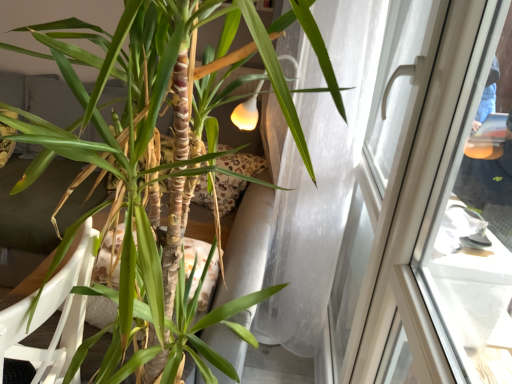
Identify the location of green matte plant at center. (149, 103).

Is green matte plant at center further to the viewer compared to transparent glass window at upper right?

No.

Is point (310, 33) more distant than point (497, 309)?

No, (310, 33) is in front of (497, 309).

Is green matte plant at center to the left of transparent glass window at upper right from the viewer's perspective?

Indeed, green matte plant at center is positioned on the left side of transparent glass window at upper right.

Between point (86, 266) and point (457, 117), which one is positioned behind?

The point (86, 266) is more distant.

Between white plastic armchair at lower left and transparent glass window at upper right, which one has more height?

Standing taller between the two is transparent glass window at upper right.

Considering the relative sizes of white plastic armchair at lower left and transparent glass window at upper right in the image provided, is white plastic armchair at lower left smaller than transparent glass window at upper right?

Incorrect, white plastic armchair at lower left is not smaller in size than transparent glass window at upper right.

Which is correct: white plastic armchair at lower left is inside transparent glass window at upper right, or outside of it?

white plastic armchair at lower left is not enclosed by transparent glass window at upper right.

From the image's perspective, does green matte plant at center appear lower than white plastic armchair at lower left?

Actually, green matte plant at center appears above white plastic armchair at lower left in the image.

How many degrees apart are the facing directions of green matte plant at center and white plastic armchair at lower left?

green matte plant at center and white plastic armchair at lower left are facing 3.54 degrees away from each other.

Is green matte plant at center looking in the opposite direction of white plastic armchair at lower left?

Correct, green matte plant at center is looking away from white plastic armchair at lower left.

In terms of width, does green matte plant at center look wider or thinner when compared to white plastic armchair at lower left?

green matte plant at center is wider than white plastic armchair at lower left.

Considering the positions of objects white plastic armchair at lower left and green matte plant at center in the image provided, who is behind, white plastic armchair at lower left or green matte plant at center?

white plastic armchair at lower left is more distant.

Would you say white plastic armchair at lower left is inside or outside green matte plant at center?

white plastic armchair at lower left exists entirely within green matte plant at center.

Which point is more distant from viewer, (61, 316) or (266, 47)?

The point (61, 316) is farther from the camera.

Does white plastic armchair at lower left have a smaller size compared to green matte plant at center?

Correct, white plastic armchair at lower left occupies less space than green matte plant at center.

Is transparent glass window at upper right thinner than white plastic armchair at lower left?

Yes.

Is transparent glass window at upper right oriented towards white plastic armchair at lower left?

No, transparent glass window at upper right is not oriented towards white plastic armchair at lower left.

Which point is more forward, (488, 73) or (69, 303)?

Positioned in front is point (488, 73).

Can you tell me how much transparent glass window at upper right and white plastic armchair at lower left differ in facing direction?

3.96 degrees separate the facing orientations of transparent glass window at upper right and white plastic armchair at lower left.

Is point (481, 155) closer to viewer compared to point (7, 46)?

No.

From the picture: From a real-world perspective, is transparent glass window at upper right positioned above or below green matte plant at center?

In terms of real-world spatial position, transparent glass window at upper right is above green matte plant at center.

Considering the relative positions of transparent glass window at upper right and green matte plant at center in the image provided, is transparent glass window at upper right to the right of green matte plant at center from the viewer's perspective?

Correct, you'll find transparent glass window at upper right to the right of green matte plant at center.

Between transparent glass window at upper right and green matte plant at center, which one has smaller size?

transparent glass window at upper right is smaller.

Identify the location of window above the green matte plant at center (from a real-world perspective). This screenshot has width=512, height=384. (429, 216).

Identify the location of armchair lying on the left of transparent glass window at upper right. This screenshot has width=512, height=384. (50, 316).

Estimate the real-world distances between objects in this image. Which object is closer to white plastic armchair at lower left, green matte plant at center or transparent glass window at upper right?

green matte plant at center lies closer to white plastic armchair at lower left than the other object.

Which object lies nearer to the anchor point transparent glass window at upper right, green matte plant at center or white plastic armchair at lower left?

green matte plant at center is positioned closer to the anchor transparent glass window at upper right.

Based on their spatial positions, is white plastic armchair at lower left or green matte plant at center closer to transparent glass window at upper right?

green matte plant at center is closer to transparent glass window at upper right.

When comparing their distances from white plastic armchair at lower left, does transparent glass window at upper right or green matte plant at center seem further?

transparent glass window at upper right.

Estimate the real-world distances between objects in this image. Which object is closer to green matte plant at center, white plastic armchair at lower left or transparent glass window at upper right?

white plastic armchair at lower left is positioned closer to the anchor green matte plant at center.

Estimate the real-world distances between objects in this image. Which object is closer to green matte plant at center, transparent glass window at upper right or white plastic armchair at lower left?

white plastic armchair at lower left is closer to green matte plant at center.

At what (x,y) coordinates should I click in order to perform the action: click on houseplant between white plastic armchair at lower left and transparent glass window at upper right in the horizontal direction. Please return your answer as a coordinate pair (x, y). This screenshot has width=512, height=384. Looking at the image, I should click on (149, 103).